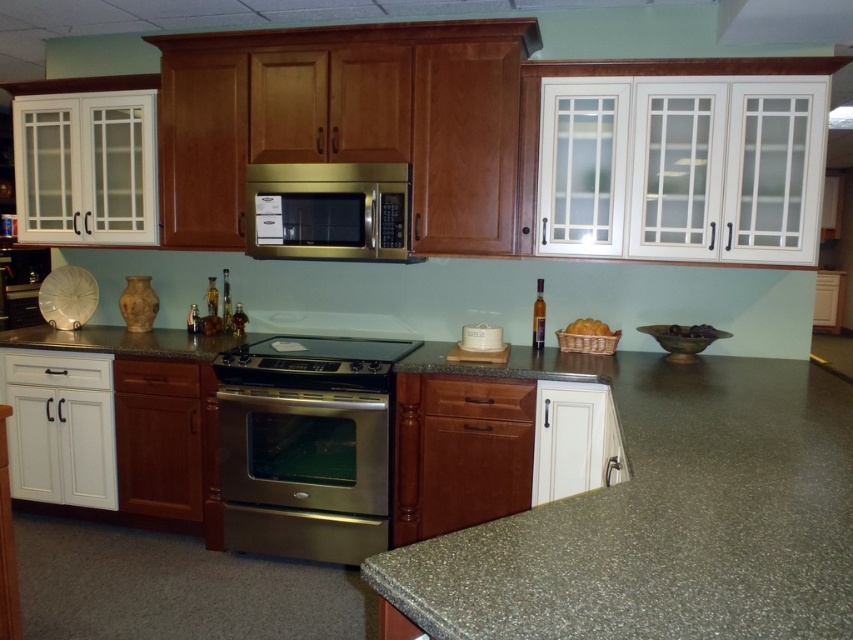
Question: Which point is farther to the camera?

Choices:
 (A) (260, 349)
 (B) (741, 35)

Answer: (A)

Question: Is satin gold microwave at center wider than satin stainless steel exhaust hood at upper center?

Choices:
 (A) yes
 (B) no

Answer: (A)

Question: Considering the relative positions of stainless steel oven at center and satin stainless steel exhaust hood at upper center in the image provided, where is stainless steel oven at center located with respect to satin stainless steel exhaust hood at upper center?

Choices:
 (A) right
 (B) left

Answer: (B)

Question: Is granite countertop at center closer to camera compared to satin gold microwave at center?

Choices:
 (A) yes
 (B) no

Answer: (A)

Question: Which point appears farthest from the camera in this image?

Choices:
 (A) (320, 353)
 (B) (432, 545)
 (C) (347, 401)

Answer: (A)

Question: Among these points, which one is farthest from the camera?

Choices:
 (A) (289, 355)
 (B) (300, 508)
 (C) (357, 253)
 (D) (721, 17)

Answer: (C)